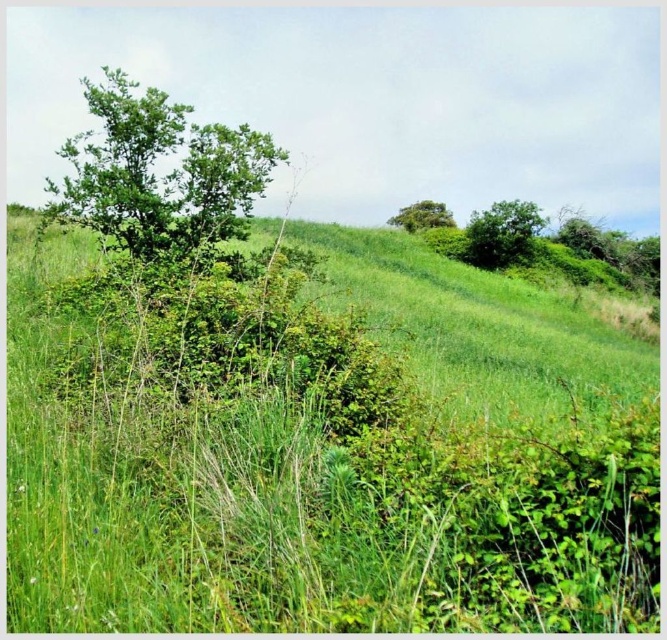
Question: Among these points, which one is nearest to the camera?

Choices:
 (A) (430, 202)
 (B) (466, 250)
 (C) (267, 570)
 (D) (87, 99)

Answer: (C)

Question: Which of the following is the closest to the observer?

Choices:
 (A) (151, 164)
 (B) (504, 230)
 (C) (430, 218)

Answer: (A)

Question: Which object is the farthest from the green leafy tree at upper right?

Choices:
 (A) green leafy tree at upper left
 (B) green leafy tree at upper center

Answer: (A)

Question: Is green leafy tree at upper left behind green leafy tree at upper right?

Choices:
 (A) yes
 (B) no

Answer: (B)

Question: Does green leafy tree at upper right have a larger size compared to green leafy tree at upper center?

Choices:
 (A) no
 (B) yes

Answer: (A)

Question: Is green leafy tree at upper left to the right of green leafy tree at upper center from the viewer's perspective?

Choices:
 (A) no
 (B) yes

Answer: (A)